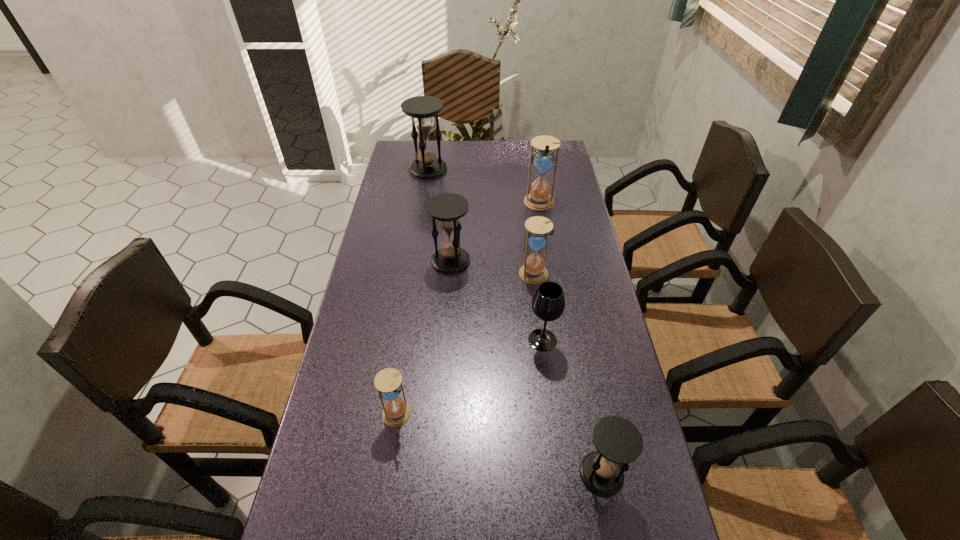
Where is `the farthest object`? Image resolution: width=960 pixels, height=540 pixels. the farthest object is located at coordinates (422, 109).

Image resolution: width=960 pixels, height=540 pixels. In order to click on the biggest black hourglass in this screenshot , I will do `click(422, 109)`.

Where is `the farthest white hourglass`? the farthest white hourglass is located at coordinates (539, 198).

The width and height of the screenshot is (960, 540). Identify the location of the biggest white hourglass. (539, 198).

At what (x,y) coordinates should I click in order to perform the action: click on the second farthest black hourglass. Please return your answer as a coordinate pair (x, y). Image resolution: width=960 pixels, height=540 pixels. Looking at the image, I should click on (447, 208).

The image size is (960, 540). Identify the location of the second nearest white hourglass. (538, 227).

What are the coordinates of `gray wineglass` in the screenshot? It's located at (548, 303).

I want to click on the third nearest object, so click(548, 303).

Locate an element on the screen. the nearest hourglass is located at coordinates (618, 442).

The height and width of the screenshot is (540, 960). Identify the location of the smallest black hourglass. tap(618, 442).